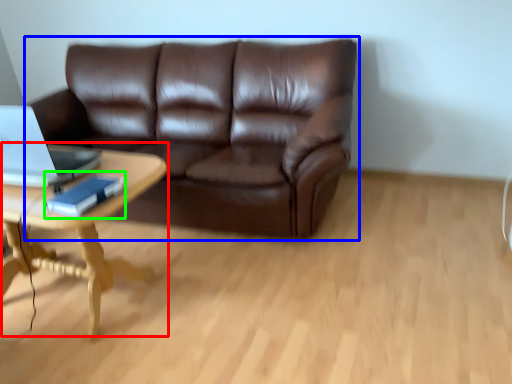
Question: Which object is the farthest from coffee table (highlighted by a red box)? Choose among these: studio couch (highlighted by a blue box) or book (highlighted by a green box).

Choices:
 (A) studio couch
 (B) book

Answer: (A)